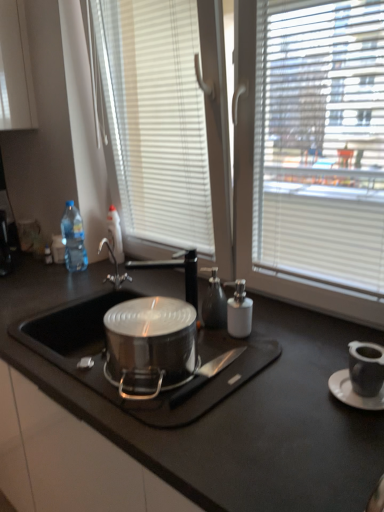
The width and height of the screenshot is (384, 512). Identify the location of vacant area that lies to the right of black matte knife at center. (256, 360).